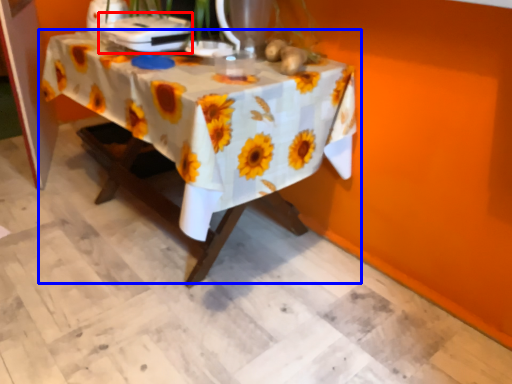
Question: Which point is closer to the camera, appliance (highlighted by a red box) or table (highlighted by a blue box)?

Choices:
 (A) appliance
 (B) table

Answer: (B)